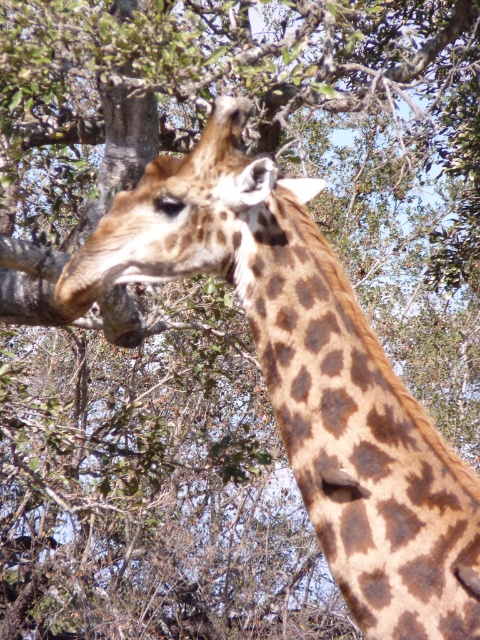
You are a wildlife photographer aiming to capture the giraffe in the image. You want to focus on the spotted fur neck at center. Based on the coordinates provided, can you confirm if the point at [358,438] is the correct location for the focus?

Yes, the point at [358,438] corresponds to the spotted fur neck at center, so focusing there will capture the desired area.

Looking at this image, you are a wildlife photographer aiming to capture the giraffe in the image. The camera you are using has a focus point at coordinates 0.686, 0.746. Based on the scene, will the spotted fur neck at center be in focus?

Yes, the spotted fur neck at center is positioned exactly at the focus point coordinates (358, 438), so it will be in focus.

You are standing in front of the giraffe and notice two points marked in the image. The first point is at coordinates point (x=303, y=292) and the second point is at point (x=229, y=211). Which of these two points is closer to you?

Point (x=303, y=292) is closer to the viewer than point (x=229, y=211).